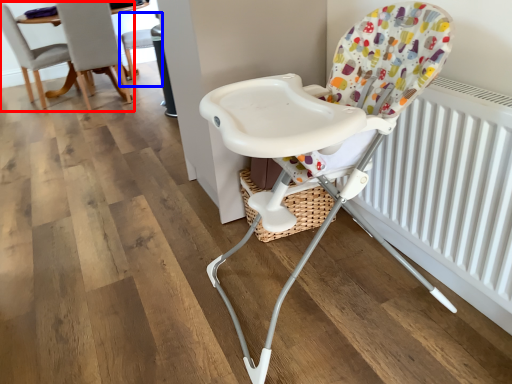
Question: Among these objects, which one is farthest to the camera, chair (highlighted by a red box) or chair (highlighted by a blue box)?

Choices:
 (A) chair
 (B) chair

Answer: (B)